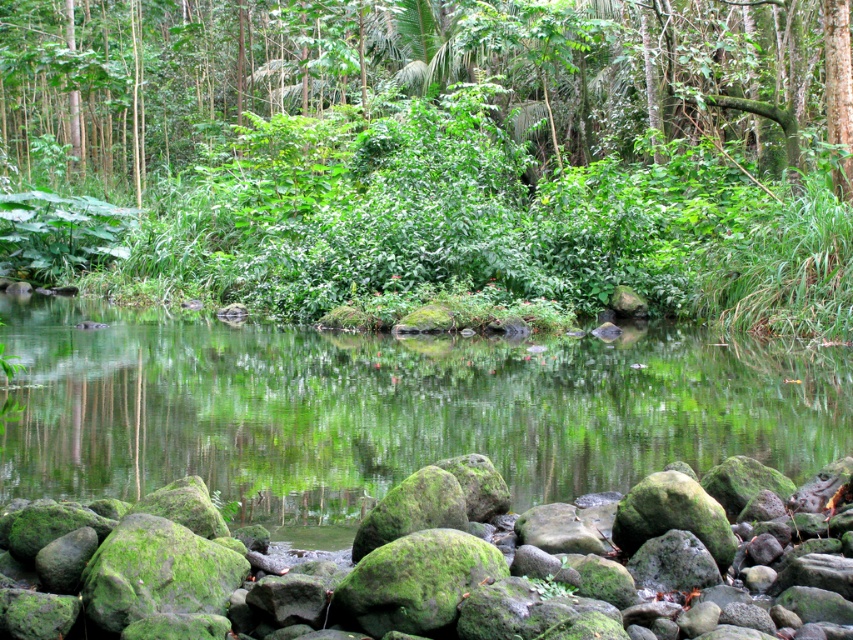
You are standing at the edge of the pond and notice two green mossy rocks. One is labeled as green mossy rocks at center and the other as green mossy rock at lower center. Which of these rocks is wider?

The green mossy rocks at center is wider than the green mossy rock at lower center.

You are standing on the path and see the green mossy rocks at center and the green mossy rock at lower center. Which one is closer to you?

The green mossy rocks at center are closer to you because they are further to the viewer than the green mossy rock at lower center.